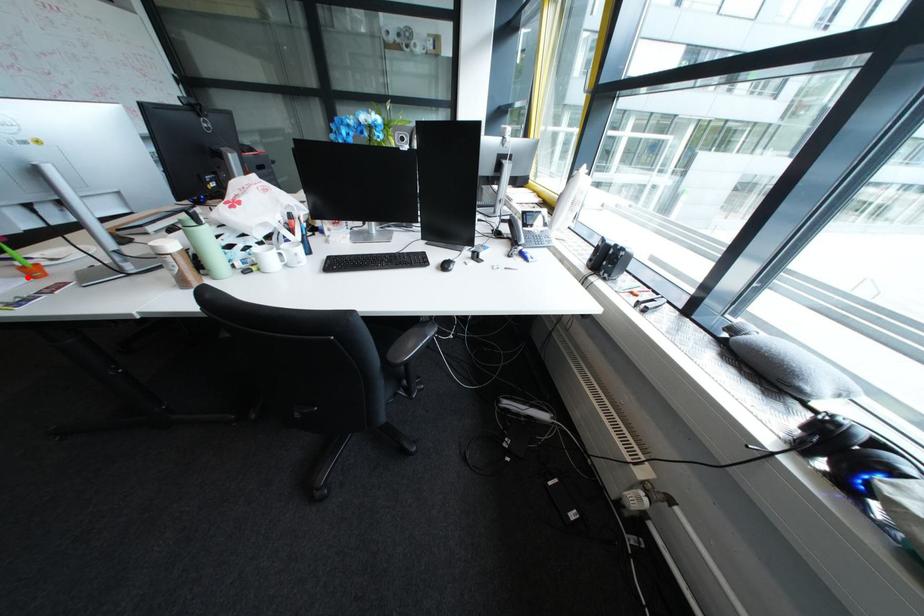
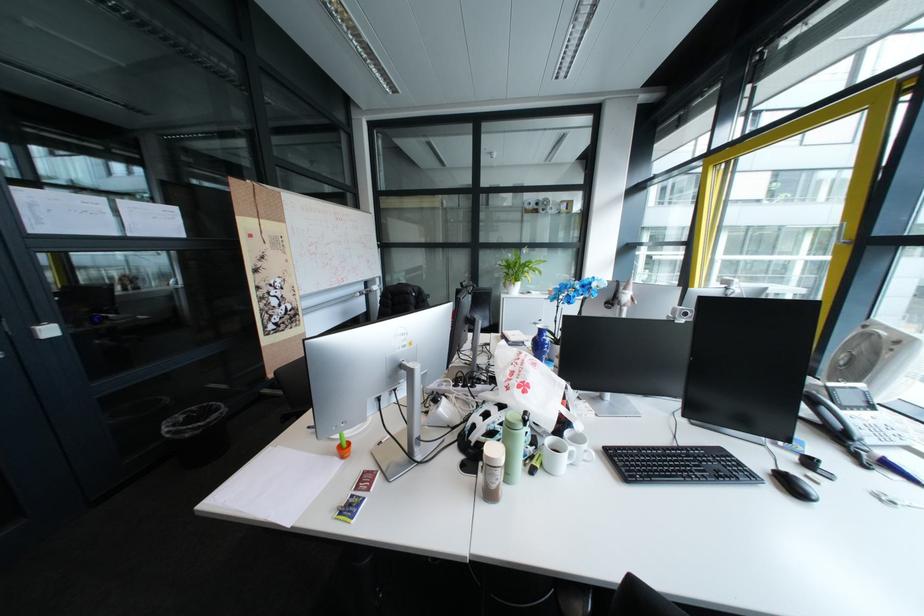
Question: I am providing you with two images of the same scene from different viewpoints. In image1, a red point is highlighted. Considering the same 3D point in image2, which of the following is correct?

Choices:
 (A) It is closer
 (B) It is farther

Answer: (B)